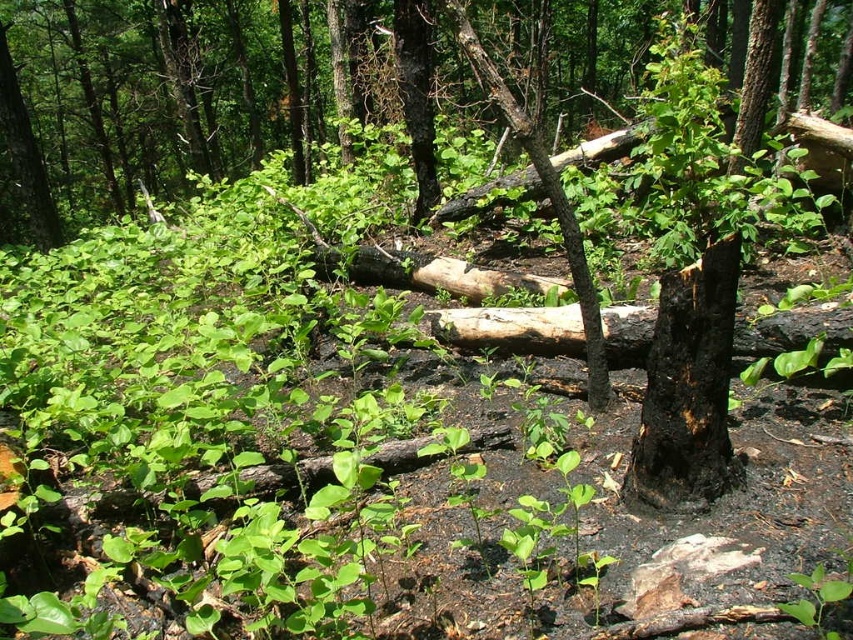
Question: Does green leafy tree at center appear on the left side of charcoal black bark at center?

Choices:
 (A) yes
 (B) no

Answer: (A)

Question: Does green leafy tree at center appear on the left side of charcoal black bark at center?

Choices:
 (A) no
 (B) yes

Answer: (B)

Question: In this image, where is green leafy tree at center located relative to charcoal black bark at center?

Choices:
 (A) left
 (B) right

Answer: (A)